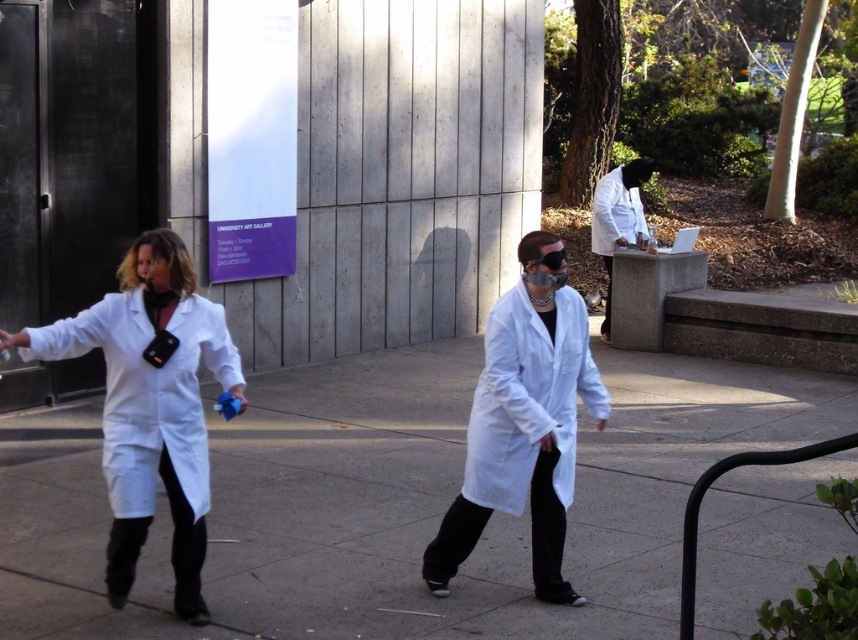
Between smooth concrete pavement at center and white lab coat at right, which one is positioned higher?

white lab coat at right is above.

Which is behind, point (757, 509) or point (613, 214)?

The point (613, 214) is more distant.

The height and width of the screenshot is (640, 858). Identify the location of smooth concrete pavement at center. (393, 502).

Is point (645, 168) positioned in front of point (599, 212)?

No, it is not.

Is white lab coat at right to the right of white matte lab coat at upper center from the viewer's perspective?

No, white lab coat at right is not to the right of white matte lab coat at upper center.

Is point (647, 166) positioned after point (613, 221)?

Yes, point (647, 166) is farther from viewer.

Where is `white lab coat at right`? The height and width of the screenshot is (640, 858). white lab coat at right is located at coordinates (617, 218).

Between white matte lab coat at left and matte white lab coat at center, which one is positioned lower?

matte white lab coat at center

Image resolution: width=858 pixels, height=640 pixels. What are the coordinates of `white matte lab coat at left` in the screenshot? It's located at (150, 404).

Find the location of a particular element. The width and height of the screenshot is (858, 640). white matte lab coat at left is located at coordinates (150, 404).

The width and height of the screenshot is (858, 640). Identify the location of white matte lab coat at left. (150, 404).